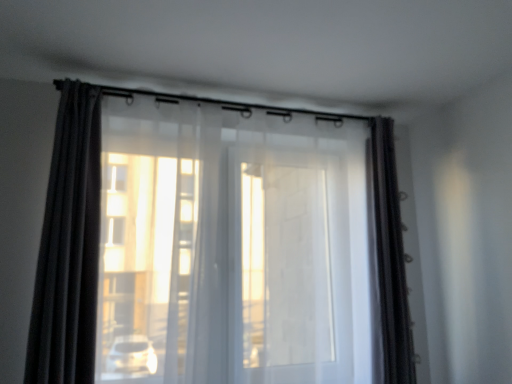
Image resolution: width=512 pixels, height=384 pixels. What do you see at coordinates (218, 245) in the screenshot?
I see `transparent fabric curtain at center, which ranks as the second curtain in left-to-right order` at bounding box center [218, 245].

What are the coordinates of `matte black curtain at left, the third curtain viewed from the right` in the screenshot? It's located at (69, 246).

At what (x,y) coordinates should I click in order to perform the action: click on transparent fabric curtain at center, the 2th curtain from the right. Please return your answer as a coordinate pair (x, y). Image resolution: width=512 pixels, height=384 pixels. Looking at the image, I should click on (218, 245).

Between satin dark brown curtain at right, which is the 1th curtain in right-to-left order, and matte black curtain at left, the third curtain viewed from the right, which one appears on the left side from the viewer's perspective?

Positioned to the left is matte black curtain at left, the third curtain viewed from the right.

Would you say satin dark brown curtain at right, the third curtain in the left-to-right sequence, is inside or outside matte black curtain at left, which is the first curtain from left to right?

satin dark brown curtain at right, the third curtain in the left-to-right sequence, is not enclosed by matte black curtain at left, which is the first curtain from left to right.

Is satin dark brown curtain at right, which is the 1th curtain in right-to-left order, facing towards matte black curtain at left, the third curtain viewed from the right?

No, satin dark brown curtain at right, which is the 1th curtain in right-to-left order, is not turned towards matte black curtain at left, the third curtain viewed from the right.

Does satin dark brown curtain at right, the third curtain in the left-to-right sequence, have a lesser height compared to matte black curtain at left, which is the first curtain from left to right?

No, satin dark brown curtain at right, the third curtain in the left-to-right sequence, is not shorter than matte black curtain at left, which is the first curtain from left to right.

Is matte black curtain at left, which is the first curtain from left to right, far away from satin dark brown curtain at right, which is the 1th curtain in right-to-left order?

That's right, there is a large distance between matte black curtain at left, which is the first curtain from left to right, and satin dark brown curtain at right, which is the 1th curtain in right-to-left order.

Where is `curtain above the satin dark brown curtain at right, which is the 1th curtain in right-to-left order (from a real-world perspective)`? The height and width of the screenshot is (384, 512). curtain above the satin dark brown curtain at right, which is the 1th curtain in right-to-left order (from a real-world perspective) is located at coordinates (69, 246).

Could you tell me if matte black curtain at left, the third curtain viewed from the right, is facing satin dark brown curtain at right, the third curtain in the left-to-right sequence?

No, matte black curtain at left, the third curtain viewed from the right, is not aimed at satin dark brown curtain at right, the third curtain in the left-to-right sequence.

Considering the sizes of objects satin dark brown curtain at right, the third curtain in the left-to-right sequence, and transparent fabric curtain at center, the 2th curtain from the right, in the image provided, who is shorter, satin dark brown curtain at right, the third curtain in the left-to-right sequence, or transparent fabric curtain at center, the 2th curtain from the right,?

satin dark brown curtain at right, the third curtain in the left-to-right sequence, is shorter.

Could you tell me if satin dark brown curtain at right, the third curtain in the left-to-right sequence, is turned towards transparent fabric curtain at center, which ranks as the second curtain in left-to-right order?

No, satin dark brown curtain at right, the third curtain in the left-to-right sequence, is not aimed at transparent fabric curtain at center, which ranks as the second curtain in left-to-right order.

Does satin dark brown curtain at right, which is the 1th curtain in right-to-left order, come behind transparent fabric curtain at center, which ranks as the second curtain in left-to-right order?

Yes, satin dark brown curtain at right, which is the 1th curtain in right-to-left order, is further from the viewer.

Considering the relative sizes of satin dark brown curtain at right, which is the 1th curtain in right-to-left order, and transparent fabric curtain at center, which ranks as the second curtain in left-to-right order, in the image provided, is satin dark brown curtain at right, which is the 1th curtain in right-to-left order, thinner than transparent fabric curtain at center, which ranks as the second curtain in left-to-right order,?

Correct, the width of satin dark brown curtain at right, which is the 1th curtain in right-to-left order, is less than that of transparent fabric curtain at center, which ranks as the second curtain in left-to-right order.

From the picture: Considering the relative sizes of transparent fabric curtain at center, the 2th curtain from the right, and satin dark brown curtain at right, which is the 1th curtain in right-to-left order, in the image provided, is transparent fabric curtain at center, the 2th curtain from the right, wider than satin dark brown curtain at right, which is the 1th curtain in right-to-left order,?

Yes, transparent fabric curtain at center, the 2th curtain from the right, is wider than satin dark brown curtain at right, which is the 1th curtain in right-to-left order.

Is satin dark brown curtain at right, the third curtain in the left-to-right sequence, a part of transparent fabric curtain at center, the 2th curtain from the right?

No, satin dark brown curtain at right, the third curtain in the left-to-right sequence, is not inside transparent fabric curtain at center, the 2th curtain from the right.

Could you tell me if transparent fabric curtain at center, which ranks as the second curtain in left-to-right order, is turned towards satin dark brown curtain at right, the third curtain in the left-to-right sequence?

Yes, transparent fabric curtain at center, which ranks as the second curtain in left-to-right order, is oriented towards satin dark brown curtain at right, the third curtain in the left-to-right sequence.

Considering the sizes of objects transparent fabric curtain at center, which ranks as the second curtain in left-to-right order, and satin dark brown curtain at right, the third curtain in the left-to-right sequence, in the image provided, who is shorter, transparent fabric curtain at center, which ranks as the second curtain in left-to-right order, or satin dark brown curtain at right, the third curtain in the left-to-right sequence,?

satin dark brown curtain at right, the third curtain in the left-to-right sequence.

Is transparent fabric curtain at center, the 2th curtain from the right, positioned beyond the bounds of matte black curtain at left, which is the first curtain from left to right?

That's correct, transparent fabric curtain at center, the 2th curtain from the right, is outside of matte black curtain at left, which is the first curtain from left to right.

Between transparent fabric curtain at center, which ranks as the second curtain in left-to-right order, and matte black curtain at left, the third curtain viewed from the right, which one appears on the left side from the viewer's perspective?

matte black curtain at left, the third curtain viewed from the right, is more to the left.

Could you measure the distance between transparent fabric curtain at center, the 2th curtain from the right, and matte black curtain at left, the third curtain viewed from the right?

transparent fabric curtain at center, the 2th curtain from the right, and matte black curtain at left, the third curtain viewed from the right, are 17.19 inches apart.

How different are the orientations of transparent fabric curtain at center, which ranks as the second curtain in left-to-right order, and matte black curtain at left, which is the first curtain from left to right, in degrees?

The angular difference between transparent fabric curtain at center, which ranks as the second curtain in left-to-right order, and matte black curtain at left, which is the first curtain from left to right, is 2.17 degrees.

From a real-world perspective, is matte black curtain at left, the third curtain viewed from the right, physically located above or below transparent fabric curtain at center, the 2th curtain from the right?

In terms of real-world spatial position, matte black curtain at left, the third curtain viewed from the right, is above transparent fabric curtain at center, the 2th curtain from the right.

From the image's perspective, which object appears higher, matte black curtain at left, which is the first curtain from left to right, or transparent fabric curtain at center, which ranks as the second curtain in left-to-right order?

matte black curtain at left, which is the first curtain from left to right, from the image's perspective.

Considering the positions of points (83, 339) and (95, 333), is point (83, 339) closer to camera compared to point (95, 333)?

Yes.

Which curtain is the 2nd one when counting from the front of the satin dark brown curtain at right, the third curtain in the left-to-right sequence? Please provide its 2D coordinates.

[(69, 246)]

Identify the location of curtain above the satin dark brown curtain at right, the third curtain in the left-to-right sequence (from the image's perspective). (69, 246).

Considering their positions, is satin dark brown curtain at right, the third curtain in the left-to-right sequence, positioned closer to transparent fabric curtain at center, which ranks as the second curtain in left-to-right order, than matte black curtain at left, the third curtain viewed from the right?

Among the two, matte black curtain at left, the third curtain viewed from the right, is located nearer to transparent fabric curtain at center, which ranks as the second curtain in left-to-right order.

Based on their spatial positions, is transparent fabric curtain at center, the 2th curtain from the right, or satin dark brown curtain at right, which is the 1th curtain in right-to-left order, further from matte black curtain at left, the third curtain viewed from the right?

satin dark brown curtain at right, which is the 1th curtain in right-to-left order, lies further to matte black curtain at left, the third curtain viewed from the right, than the other object.

Looking at this image, estimate the real-world distances between objects in this image. Which object is closer to satin dark brown curtain at right, the third curtain in the left-to-right sequence, transparent fabric curtain at center, the 2th curtain from the right, or matte black curtain at left, which is the first curtain from left to right?

transparent fabric curtain at center, the 2th curtain from the right, is positioned closer to the anchor satin dark brown curtain at right, the third curtain in the left-to-right sequence.

Which object lies further to the anchor point transparent fabric curtain at center, which ranks as the second curtain in left-to-right order, matte black curtain at left, which is the first curtain from left to right, or satin dark brown curtain at right, the third curtain in the left-to-right sequence?

Among the two, satin dark brown curtain at right, the third curtain in the left-to-right sequence, is located further to transparent fabric curtain at center, which ranks as the second curtain in left-to-right order.

Looking at the image, which one is located closer to matte black curtain at left, which is the first curtain from left to right, satin dark brown curtain at right, which is the 1th curtain in right-to-left order, or transparent fabric curtain at center, the 2th curtain from the right?

The object closer to matte black curtain at left, which is the first curtain from left to right, is transparent fabric curtain at center, the 2th curtain from the right.

Looking at the image, which one is located further to satin dark brown curtain at right, the third curtain in the left-to-right sequence, matte black curtain at left, the third curtain viewed from the right, or transparent fabric curtain at center, the 2th curtain from the right?

Among the two, matte black curtain at left, the third curtain viewed from the right, is located further to satin dark brown curtain at right, the third curtain in the left-to-right sequence.

Image resolution: width=512 pixels, height=384 pixels. Identify the location of curtain located between matte black curtain at left, the third curtain viewed from the right, and satin dark brown curtain at right, the third curtain in the left-to-right sequence, in the left-right direction. (218, 245).